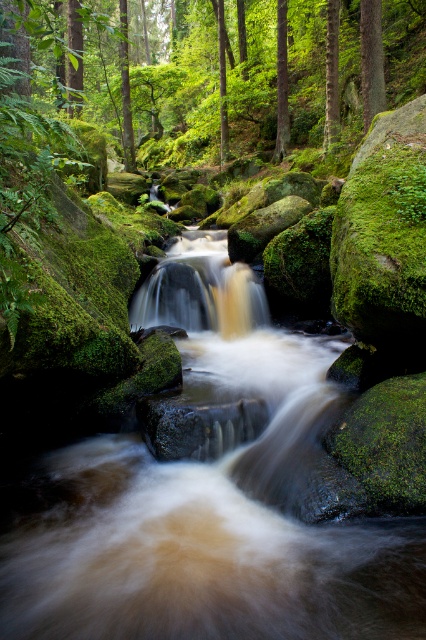
Question: Does brown smooth water at center lie behind brown textured tree at center?

Choices:
 (A) yes
 (B) no

Answer: (B)

Question: Which object is the closest to the green rough bark tree at upper center?

Choices:
 (A) green matte tree at upper center
 (B) brown smooth water at center

Answer: (A)

Question: Is brown smooth water at center thinner than green mossy rocks at center?

Choices:
 (A) no
 (B) yes

Answer: (B)

Question: Can you confirm if green mossy rocks at center is wider than brown textured tree at center?

Choices:
 (A) yes
 (B) no

Answer: (A)

Question: Which of these objects is positioned farthest from the green matte tree at upper center?

Choices:
 (A) brown textured tree at center
 (B) green mossy rocks at center
 (C) green rough bark tree at upper center
 (D) brown smooth water at center

Answer: (D)

Question: Which of these objects is positioned farthest from the brown smooth water at center?

Choices:
 (A) green matte tree at upper center
 (B) green mossy rocks at center

Answer: (B)